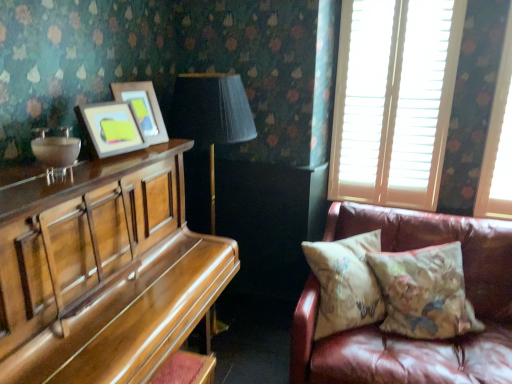
This screenshot has width=512, height=384. I want to click on vacant area in front of matte wooden picture frame at upper left, which is the 2th picture frame from back to front, so click(108, 166).